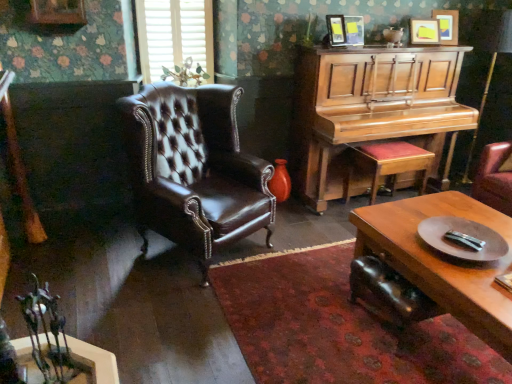
This screenshot has width=512, height=384. Find the location of `free point above white matte blinds at upper left (from a real-world perspective)`. free point above white matte blinds at upper left (from a real-world perspective) is located at coordinates (173, 1).